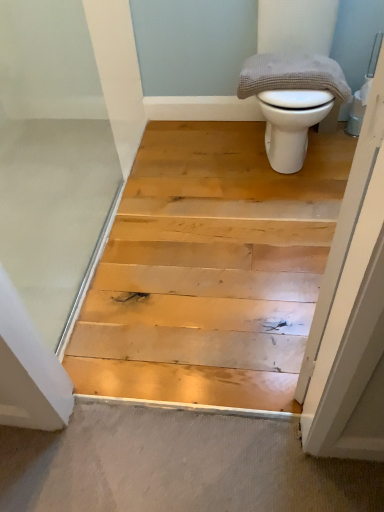
Image resolution: width=384 pixels, height=512 pixels. What are the coordinates of `white glossy toilet at upper right` in the screenshot? It's located at (291, 101).

Describe the element at coordinates (291, 101) in the screenshot. I see `white glossy toilet at upper right` at that location.

What do you see at coordinates (292, 75) in the screenshot?
I see `gray textured towel at upper right` at bounding box center [292, 75].

You are a GUI agent. You are given a task and a screenshot of the screen. Output one action in this format:
    pyautogui.click(x=<x>, y=<y>)
    Task: Click on the gray textured towel at upper right
    
    Given the screenshot: What is the action you would take?
    pyautogui.click(x=292, y=75)

Locate an element on the screen. The height and width of the screenshot is (512, 384). white glossy toilet at upper right is located at coordinates (291, 101).

Can you confirm if gray textured towel at upper right is positioned to the left of white glossy toilet at upper right?

Indeed, gray textured towel at upper right is positioned on the left side of white glossy toilet at upper right.

Is gray textured towel at upper right further to the viewer compared to white glossy toilet at upper right?

Yes, gray textured towel at upper right is further from the viewer.

Is point (283, 68) positioned before point (304, 80)?

No, (283, 68) is behind (304, 80).

Consider the image. From the image's perspective, does gray textured towel at upper right appear higher than white glossy toilet at upper right?

Incorrect, from the image's perspective, gray textured towel at upper right is lower than white glossy toilet at upper right.

From the picture: From a real-world perspective, which object stands above the other?

In real-world perspective, gray textured towel at upper right is above.

Considering the sizes of objects gray textured towel at upper right and white glossy toilet at upper right in the image provided, who is wider, gray textured towel at upper right or white glossy toilet at upper right?

Wider between the two is white glossy toilet at upper right.

Does gray textured towel at upper right have a lesser height compared to white glossy toilet at upper right?

Indeed, gray textured towel at upper right has a lesser height compared to white glossy toilet at upper right.

Between gray textured towel at upper right and white glossy toilet at upper right, which one has larger size?

white glossy toilet at upper right is bigger.

Which is correct: gray textured towel at upper right is inside white glossy toilet at upper right, or outside of it?

gray textured towel at upper right is inside white glossy toilet at upper right.

Is gray textured towel at upper right not near white glossy toilet at upper right?

gray textured towel at upper right is actually quite close to white glossy toilet at upper right.

Is white glossy toilet at upper right at the back of gray textured towel at upper right?

Correct, gray textured towel at upper right is looking away from white glossy toilet at upper right.

Where is `material on the left of white glossy toilet at upper right`? The image size is (384, 512). material on the left of white glossy toilet at upper right is located at coordinates (292, 75).

Visually, is white glossy toilet at upper right positioned to the left or to the right of gray textured towel at upper right?

white glossy toilet at upper right is positioned on gray textured towel at upper right's right side.

Is white glossy toilet at upper right in front of or behind gray textured towel at upper right in the image?

In the image, white glossy toilet at upper right appears in front of gray textured towel at upper right.

Is point (329, 85) farther from viewer compared to point (270, 66)?

No, it is not.

From the image's perspective, between white glossy toilet at upper right and gray textured towel at upper right, who is located below?

From the image's view, gray textured towel at upper right is below.

From a real-world perspective, relative to gray textured towel at upper right, is white glossy toilet at upper right vertically above or below?

white glossy toilet at upper right is below gray textured towel at upper right.

Between white glossy toilet at upper right and gray textured towel at upper right, which one has smaller width?

With smaller width is gray textured towel at upper right.

Is white glossy toilet at upper right taller or shorter than gray textured towel at upper right?

Considering their sizes, white glossy toilet at upper right has more height than gray textured towel at upper right.

Between white glossy toilet at upper right and gray textured towel at upper right, which one has smaller size?

gray textured towel at upper right.

Is white glossy toilet at upper right not inside gray textured towel at upper right?

Yes.

Consider the image. Is white glossy toilet at upper right far from gray textured towel at upper right?

No, there isn't a large distance between white glossy toilet at upper right and gray textured towel at upper right.

Could you tell me if white glossy toilet at upper right is turned towards gray textured towel at upper right?

Yes, white glossy toilet at upper right faces towards gray textured towel at upper right.

Locate an element on the screen. material that appears on the left of white glossy toilet at upper right is located at coordinates (292, 75).

In the image, there is a gray textured towel at upper right. At what (x,y) coordinates should I click in order to perform the action: click on toilet below it (from a real-world perspective). Please return your answer as a coordinate pair (x, y). Image resolution: width=384 pixels, height=512 pixels. Looking at the image, I should click on (291, 101).

Where is `toilet above the gray textured towel at upper right (from the image's perspective)`? Image resolution: width=384 pixels, height=512 pixels. toilet above the gray textured towel at upper right (from the image's perspective) is located at coordinates (291, 101).